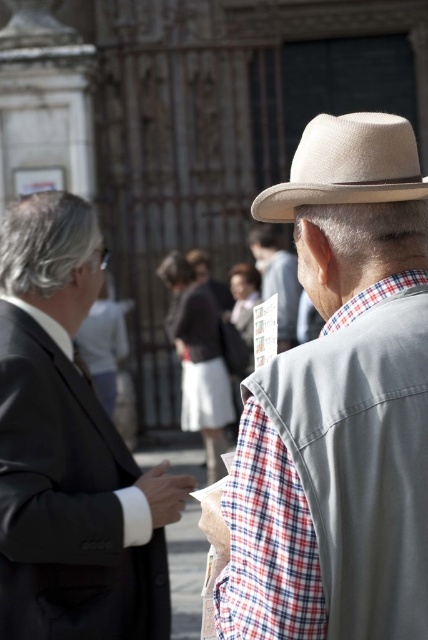
Is point (115, 582) closer to viewer compared to point (374, 147)?

That is False.

This screenshot has width=428, height=640. I want to click on matte black suit at left, so click(68, 449).

Does light beige felt fedora at center have a greater height compared to plaid fabric shirt at center?

Indeed, light beige felt fedora at center has a greater height compared to plaid fabric shirt at center.

Does light beige felt fedora at center appear on the right side of plaid fabric shirt at center?

Correct, you'll find light beige felt fedora at center to the right of plaid fabric shirt at center.

This screenshot has height=640, width=428. Describe the element at coordinates (347, 164) in the screenshot. I see `light beige felt fedora at center` at that location.

Locate an element on the screen. light beige felt fedora at center is located at coordinates (347, 164).

Is beige straw hat at upper right shorter than light beige felt fedora at center?

Incorrect, beige straw hat at upper right's height does not fall short of light beige felt fedora at center's.

Which is in front, point (353, 404) or point (296, 202)?

Point (353, 404)

Identify the location of beige straw hat at upper right. (336, 406).